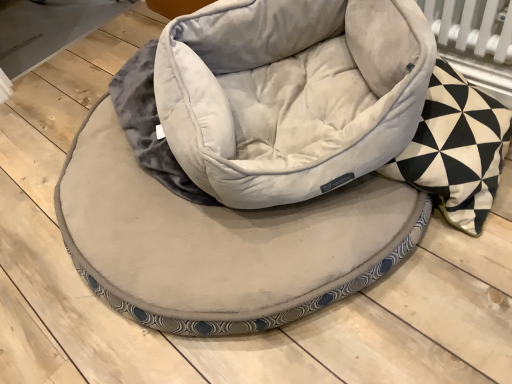
What do you see at coordinates (456, 149) in the screenshot? The image size is (512, 384). I see `black and white geometric patterned pillow at right` at bounding box center [456, 149].

What is the approximate height of suede-like beige bean bag chair at center?

suede-like beige bean bag chair at center is 12.69 inches tall.

Where is `velvet-like beige dog bed at center`? The image size is (512, 384). velvet-like beige dog bed at center is located at coordinates (256, 165).

From the image's perspective, which one is positioned higher, black and white geometric patterned pillow at right or suede-like beige bean bag chair at center?

suede-like beige bean bag chair at center appears higher in the image.

Looking at this image, considering the positions of objects black and white geometric patterned pillow at right and suede-like beige bean bag chair at center in the image provided, who is in front, black and white geometric patterned pillow at right or suede-like beige bean bag chair at center?

black and white geometric patterned pillow at right.

How far apart are black and white geometric patterned pillow at right and suede-like beige bean bag chair at center?

black and white geometric patterned pillow at right and suede-like beige bean bag chair at center are 10.47 inches apart.

Does black and white geometric patterned pillow at right appear on the right side of suede-like beige bean bag chair at center?

Yes.

Which object is closer to the camera taking this photo, velvet-like beige dog bed at center or black and white geometric patterned pillow at right?

Positioned in front is black and white geometric patterned pillow at right.

From the image's perspective, between velvet-like beige dog bed at center and black and white geometric patterned pillow at right, which one is located above?

black and white geometric patterned pillow at right.

Is velvet-like beige dog bed at center aimed at black and white geometric patterned pillow at right?

No, velvet-like beige dog bed at center is not turned towards black and white geometric patterned pillow at right.

Considering the relative positions of velvet-like beige dog bed at center and black and white geometric patterned pillow at right in the image provided, is velvet-like beige dog bed at center to the left or to the right of black and white geometric patterned pillow at right?

Clearly, velvet-like beige dog bed at center is on the left of black and white geometric patterned pillow at right in the image.

How different are the orientations of black and white geometric patterned pillow at right and velvet-like beige dog bed at center in degrees?

black and white geometric patterned pillow at right and velvet-like beige dog bed at center are facing 119 degrees away from each other.

Between black and white geometric patterned pillow at right and velvet-like beige dog bed at center, which one has more height?

black and white geometric patterned pillow at right.

Does black and white geometric patterned pillow at right contain velvet-like beige dog bed at center?

No, velvet-like beige dog bed at center is located outside of black and white geometric patterned pillow at right.

Considering the sizes of objects black and white geometric patterned pillow at right and velvet-like beige dog bed at center in the image provided, who is wider, black and white geometric patterned pillow at right or velvet-like beige dog bed at center?

With larger width is velvet-like beige dog bed at center.

Where is `throw pillow beneath the suede-like beige bean bag chair at center (from a real-world perspective)`? This screenshot has height=384, width=512. throw pillow beneath the suede-like beige bean bag chair at center (from a real-world perspective) is located at coordinates (456, 149).

Consider the image. Does suede-like beige bean bag chair at center appear on the left side of black and white geometric patterned pillow at right?

Yes, suede-like beige bean bag chair at center is to the left of black and white geometric patterned pillow at right.

From a real-world perspective, is suede-like beige bean bag chair at center above or below black and white geometric patterned pillow at right?

In terms of real-world spatial position, suede-like beige bean bag chair at center is above black and white geometric patterned pillow at right.

From the picture: Does suede-like beige bean bag chair at center turn towards black and white geometric patterned pillow at right?

Yes.

The width and height of the screenshot is (512, 384). I want to click on bean bag chair on the right of velvet-like beige dog bed at center, so click(x=290, y=94).

Which is more to the left, suede-like beige bean bag chair at center or velvet-like beige dog bed at center?

Positioned to the left is velvet-like beige dog bed at center.

Which is closer, (x=249, y=166) or (x=261, y=22)?

Point (x=249, y=166) appears to be closer to the viewer than point (x=261, y=22).

Considering the positions of objects velvet-like beige dog bed at center and suede-like beige bean bag chair at center in the image provided, who is more to the right, velvet-like beige dog bed at center or suede-like beige bean bag chair at center?

Positioned to the right is suede-like beige bean bag chair at center.

Considering the positions of point (423, 95) and point (289, 22), is point (423, 95) closer or farther from the camera than point (289, 22)?

Point (423, 95) is closer to the camera than point (289, 22).

Is velvet-like beige dog bed at center facing towards suede-like beige bean bag chair at center?

No, velvet-like beige dog bed at center does not turn towards suede-like beige bean bag chair at center.

Does velvet-like beige dog bed at center have a lesser height compared to suede-like beige bean bag chair at center?

Yes, velvet-like beige dog bed at center is shorter than suede-like beige bean bag chair at center.

Where is `throw pillow on the right of suede-like beige bean bag chair at center`? The height and width of the screenshot is (384, 512). throw pillow on the right of suede-like beige bean bag chair at center is located at coordinates (456, 149).

The width and height of the screenshot is (512, 384). Find the location of `throw pillow in front of the velvet-like beige dog bed at center`. throw pillow in front of the velvet-like beige dog bed at center is located at coordinates (456, 149).

Based on their spatial positions, is velvet-like beige dog bed at center or suede-like beige bean bag chair at center further from black and white geometric patterned pillow at right?

The object further to black and white geometric patterned pillow at right is velvet-like beige dog bed at center.

When comparing their distances from black and white geometric patterned pillow at right, does suede-like beige bean bag chair at center or velvet-like beige dog bed at center seem closer?

suede-like beige bean bag chair at center is positioned closer to the anchor black and white geometric patterned pillow at right.

Considering their positions, is velvet-like beige dog bed at center positioned closer to suede-like beige bean bag chair at center than black and white geometric patterned pillow at right?

velvet-like beige dog bed at center.

From the image, which object appears to be nearer to velvet-like beige dog bed at center, suede-like beige bean bag chair at center or black and white geometric patterned pillow at right?

Based on the image, suede-like beige bean bag chair at center appears to be nearer to velvet-like beige dog bed at center.

Looking at the image, which one is located closer to suede-like beige bean bag chair at center, black and white geometric patterned pillow at right or velvet-like beige dog bed at center?

velvet-like beige dog bed at center lies closer to suede-like beige bean bag chair at center than the other object.

Based on their spatial positions, is black and white geometric patterned pillow at right or suede-like beige bean bag chair at center further from velvet-like beige dog bed at center?

The object further to velvet-like beige dog bed at center is black and white geometric patterned pillow at right.

Where is `bean bag chair between velvet-like beige dog bed at center and black and white geometric patterned pillow at right`? This screenshot has width=512, height=384. bean bag chair between velvet-like beige dog bed at center and black and white geometric patterned pillow at right is located at coordinates (290, 94).